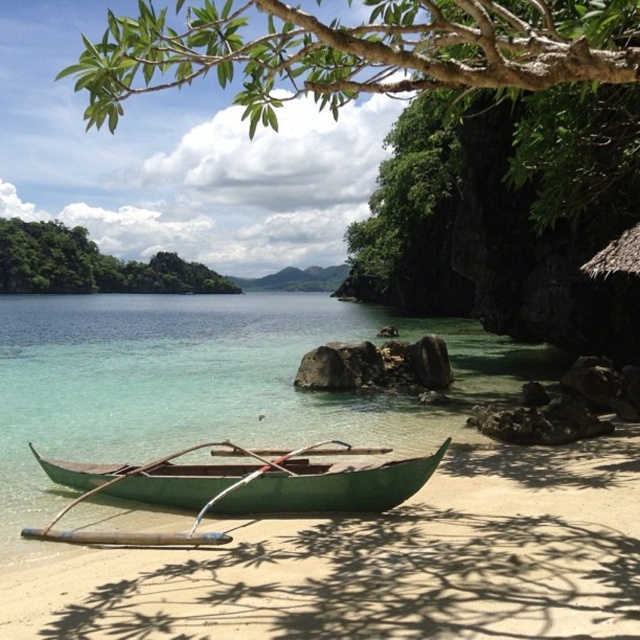
You are standing on the beach and want to take a photo of the point at coordinates [493,525]. The camera you have can focus on objects up to 7 meters away. Will the point be in focus?

The point at coordinates [493,525] is 6.98 meters away from the camera, which is within the camera focus range of 7 meters. Therefore, the point will be in focus.

Looking at this image, you are standing on the beach and want to take a photo of the green sand at lower center and the green leafy tree at upper left together in the frame. Which direction should you face to include both in your photo?

You should face towards the right side of the green leafy tree at upper left to include both the green sand at lower center and the green leafy tree at upper left in the photo, since the green sand at lower center is positioned on the right side of the green leafy tree at upper left.

In the scene shown: You are standing on the beach and want to place a small flag between the green sand at lower center and the green leafy tree at upper left. Which object will the flag be closer to?

The flag will be closer to the green sand at lower center because it is not as tall as the green leafy tree at upper left, so the tree is further away from the flag than the sand.